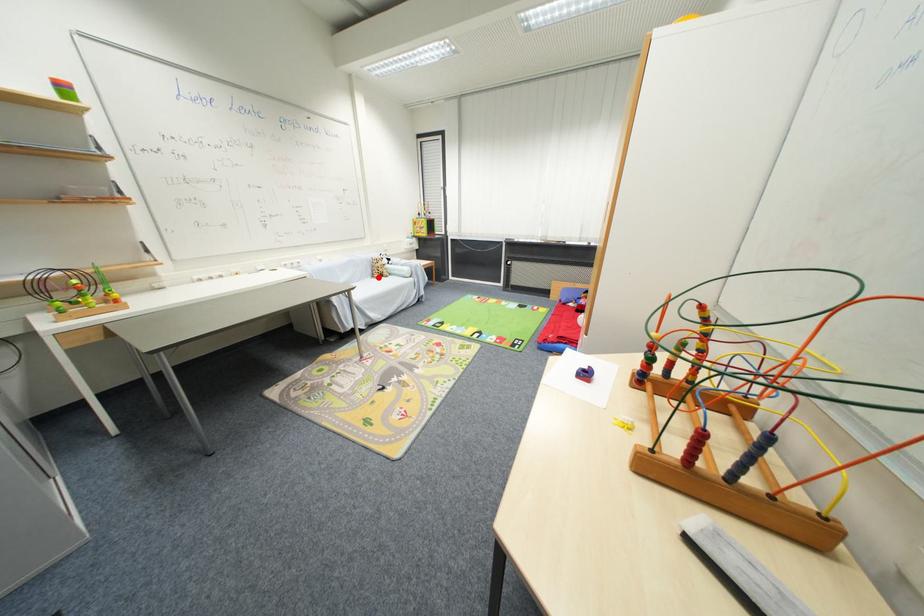
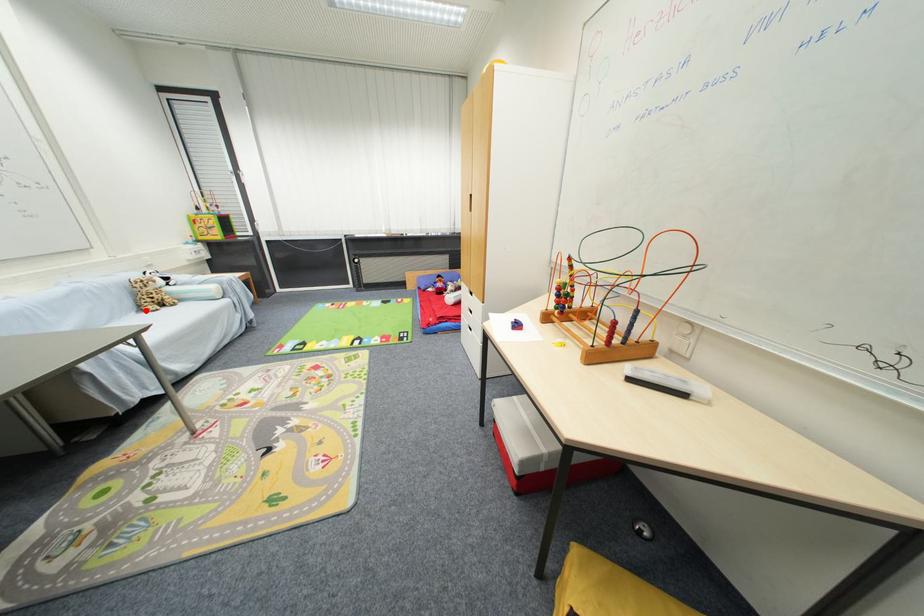
I am providing you with two images of the same scene from different viewpoints. A red point is marked on the first image and another point is marked on the second image. Is the red point in image1 aligned with the point shown in image2?

Yes